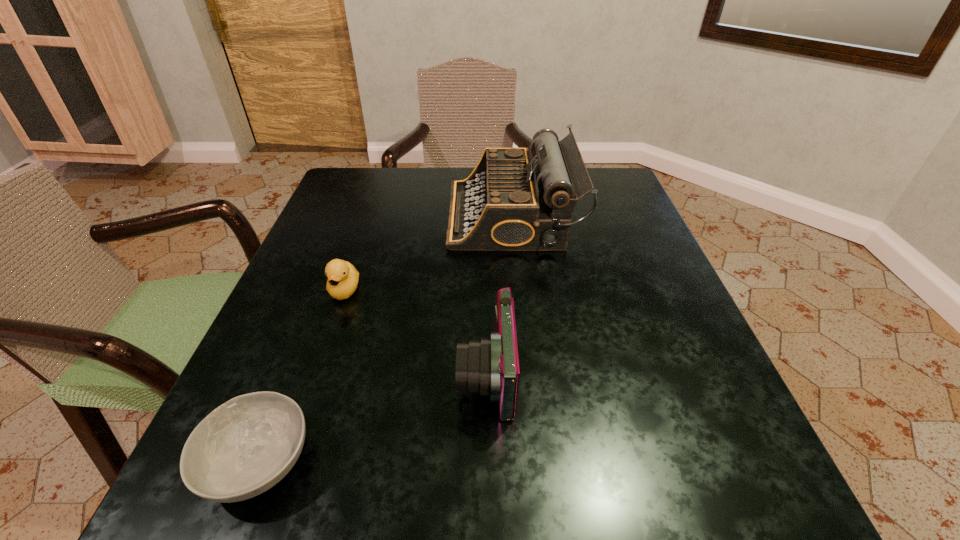
The image size is (960, 540). Find the location of `vacant space that's between the third nearest object and the camera`. vacant space that's between the third nearest object and the camera is located at coordinates (416, 332).

In order to click on free space between the bowl and the tallest object in this screenshot , I will do `click(385, 339)`.

Image resolution: width=960 pixels, height=540 pixels. Find the location of `empty space that is in between the farthest object and the third tallest object`. empty space that is in between the farthest object and the third tallest object is located at coordinates (428, 253).

Locate an element on the screen. vacant point located between the duckling and the tallest object is located at coordinates (428, 253).

Locate an element on the screen. empty space that is in between the second shortest object and the camera is located at coordinates (416, 332).

At what (x,y) coordinates should I click in order to perform the action: click on vacant space in between the tallest object and the duckling. Please return your answer as a coordinate pair (x, y). The height and width of the screenshot is (540, 960). Looking at the image, I should click on (428, 253).

Choose which object is the nearest neighbor to the camera. Please provide its 2D coordinates. Your answer should be formatted as a tuple, i.e. [(x, y)], where the tuple contains the x and y coordinates of a point satisfying the conditions above.

[(247, 445)]

Identify the location of the second closest object to the duckling. The width and height of the screenshot is (960, 540). (490, 367).

What are the coordinates of `free point that satisfies the following two spatial constraints: 1. on the keyboard of the typewriter; 2. on the front side of the bowl` in the screenshot? It's located at (537, 462).

Find the location of `vacant space that satisfies the following two spatial constraints: 1. on the keyboard of the farthest object; 2. facing forward on the second farthest object`. vacant space that satisfies the following two spatial constraints: 1. on the keyboard of the farthest object; 2. facing forward on the second farthest object is located at coordinates (519, 290).